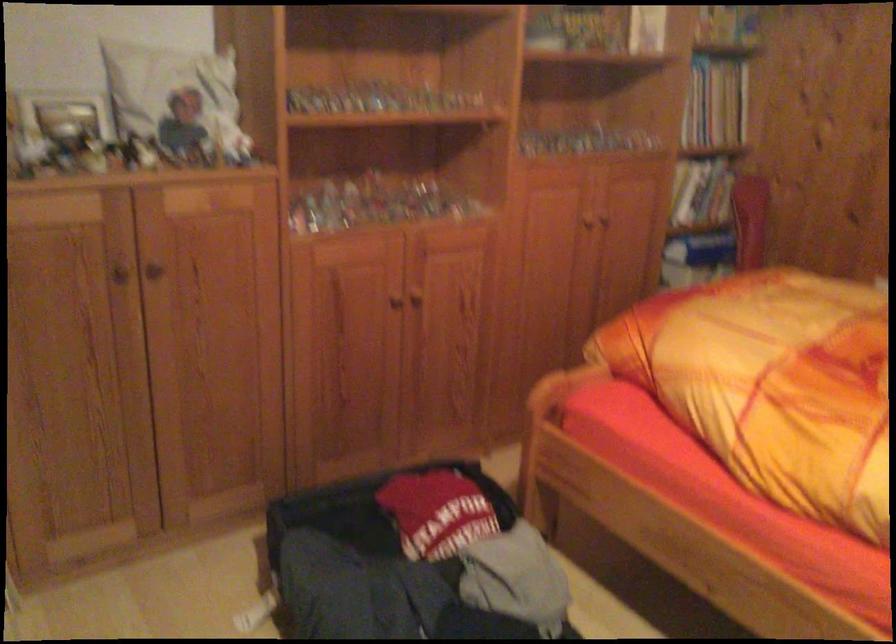
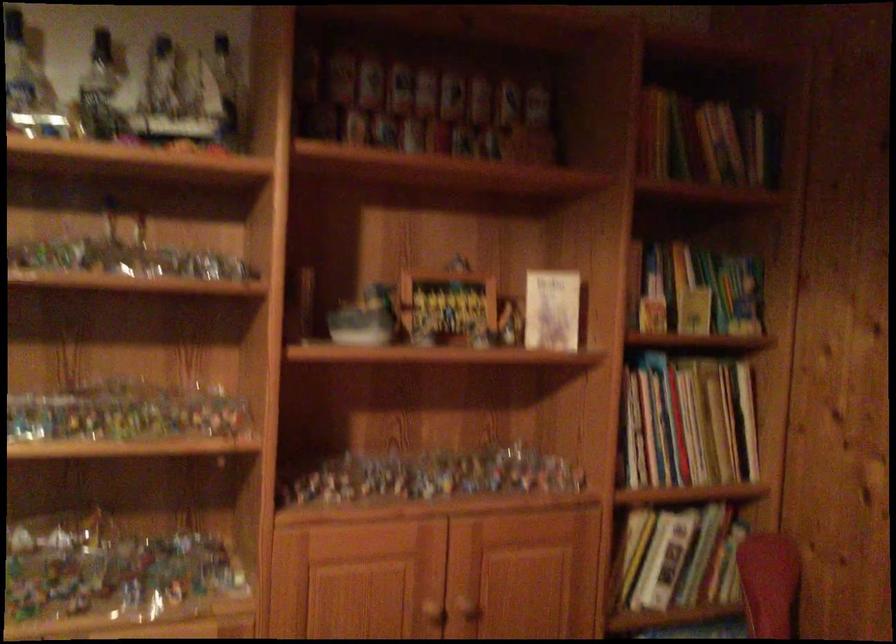
In a continuous first-person perspective shot, in which direction is the camera moving?

The cameraman moved toward right, forward.